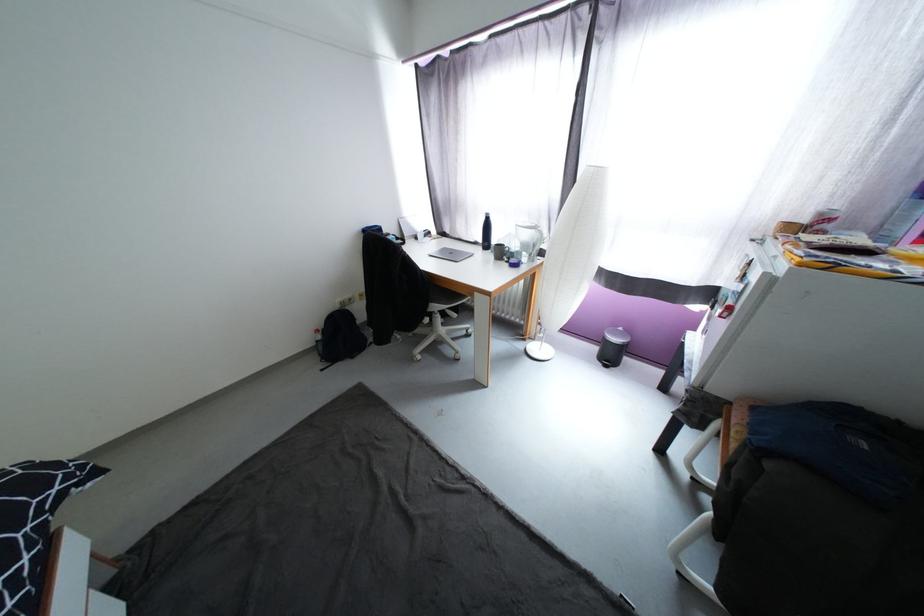
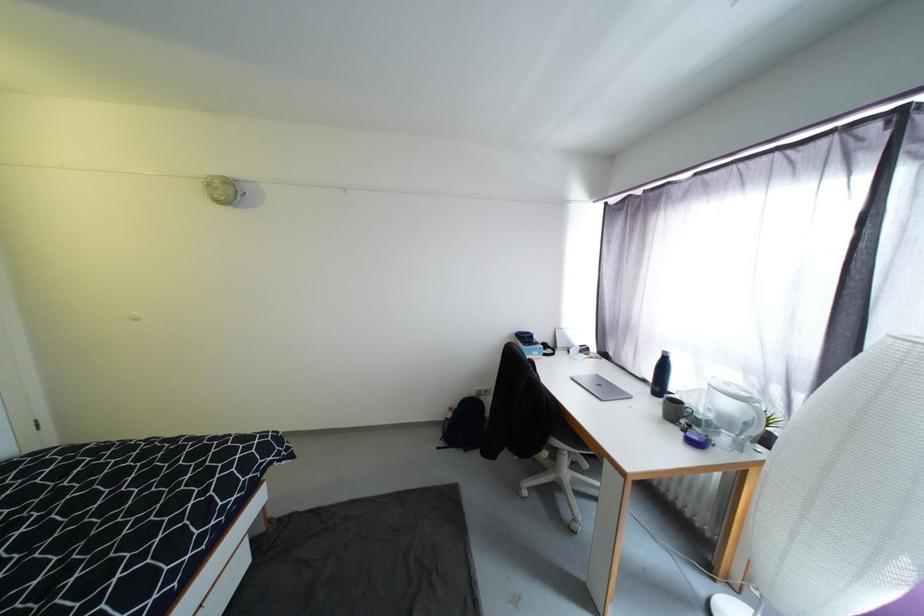
In the second image, find the point that corresponds to point (515, 260) in the first image.

(696, 427)